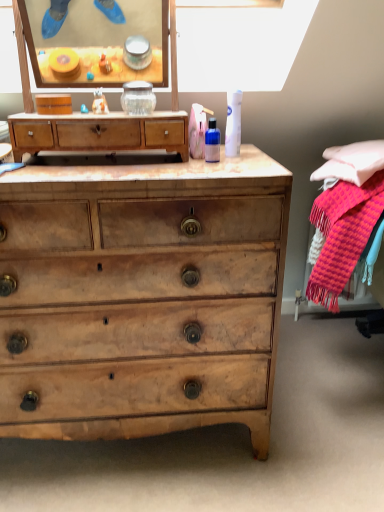
Where is `empty space that is ontop of light brown wooden chest of drawers at center, the second chest of drawers in the bottom-to-top sequence`? The height and width of the screenshot is (512, 384). empty space that is ontop of light brown wooden chest of drawers at center, the second chest of drawers in the bottom-to-top sequence is located at coordinates (94, 109).